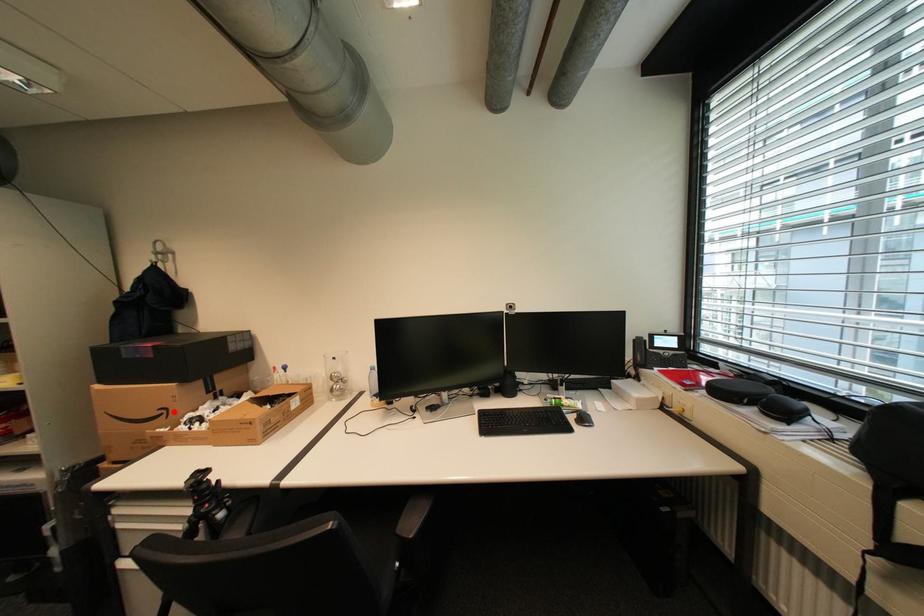
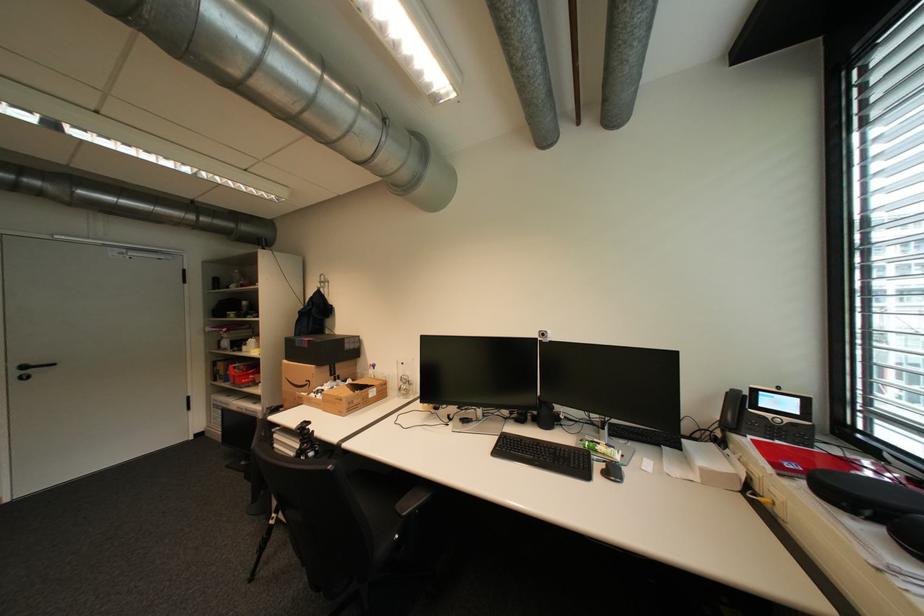
Question: I am providing you with two images of the same scene from different viewpoints. A red point is shown in image1. For the corresponding object point in image2, is it positioned nearer or farther from the camera?

Choices:
 (A) Nearer
 (B) Farther

Answer: (B)